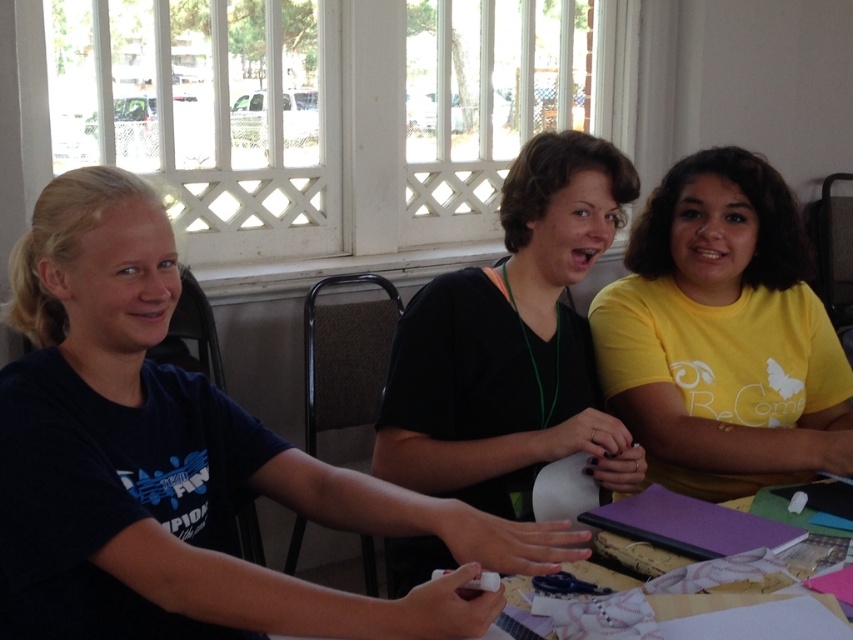
Does dark blue t-shirt at left have a greater height compared to wooden table at center?

Indeed, dark blue t-shirt at left has a greater height compared to wooden table at center.

At what (x,y) coordinates should I click in order to perform the action: click on dark blue t-shirt at left. Please return your answer as a coordinate pair (x, y). This screenshot has width=853, height=640. Looking at the image, I should click on (181, 465).

Is black matte shirt at center taller than wooden table at center?

Yes, black matte shirt at center is taller than wooden table at center.

Between point (440, 317) and point (833, 605), which one is positioned behind?

Point (440, 317)

Is point (401, 452) closer to viewer compared to point (575, 573)?

That is False.

Where is `black matte shirt at center`? This screenshot has height=640, width=853. black matte shirt at center is located at coordinates (512, 342).

Between dark blue t-shirt at left and yellow matte shirt at center, which one is positioned lower?

dark blue t-shirt at left is lower down.

Can you confirm if dark blue t-shirt at left is positioned to the left of yellow matte shirt at center?

Yes, dark blue t-shirt at left is to the left of yellow matte shirt at center.

At what (x,y) coordinates should I click in order to perform the action: click on dark blue t-shirt at left. Please return your answer as a coordinate pair (x, y). Looking at the image, I should click on (181, 465).